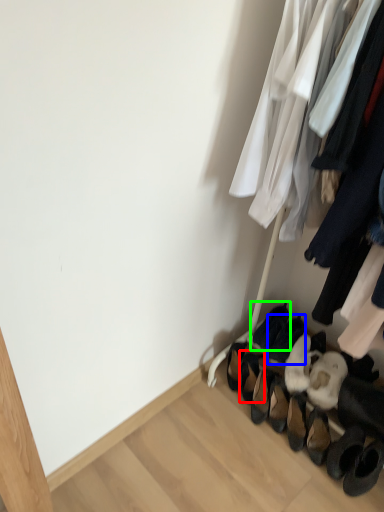
Question: Considering the real-world distances, which object is farthest from footwear (highlighted by a red box)? footwear (highlighted by a blue box) or footwear (highlighted by a green box)?

Choices:
 (A) footwear
 (B) footwear

Answer: (A)